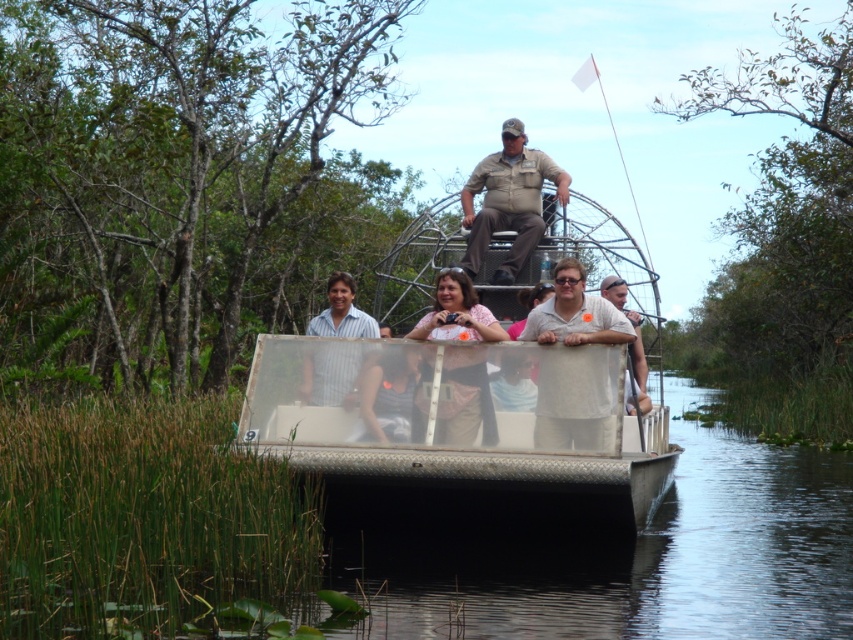
You are a photographer on the airboat and notice the pink fabric purse at center and the striped cotton shirt at center. Which object should you focus on if you want to capture the taller item in your shot?

The pink fabric purse at center is taller than the striped cotton shirt at center, so you should focus on the pink fabric purse at center to capture the taller item in your shot.

You are a passenger on the metallic silver airboat at center and want to hand a souvenir to a friend wearing the striped cotton shirt at center. Given that the average human arm length is 0.7 meters, can you reach them without leaving your seat?

The distance between the metallic silver airboat at center and the striped cotton shirt at center is 4.65 meters, which is much greater than the 0.7 meters arm length. Therefore, you cannot reach them without leaving your seat.